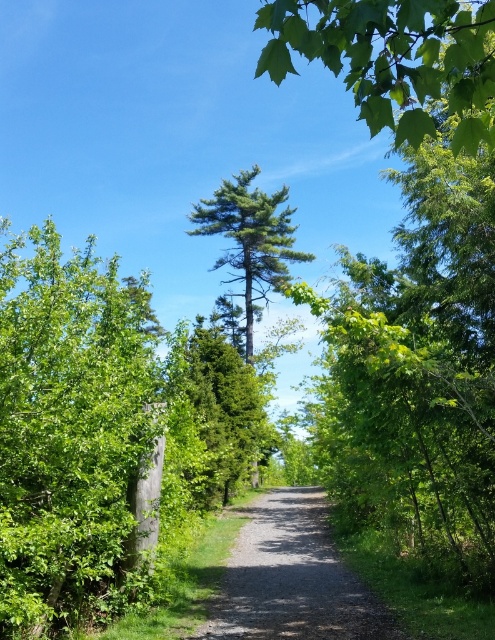
Which is below, green leafy tree at left or dirt/gravel path at center?

Positioned lower is dirt/gravel path at center.

Who is positioned more to the left, green leafy tree at left or dirt/gravel path at center?

From the viewer's perspective, green leafy tree at left appears more on the left side.

Where is `green leafy tree at left`? green leafy tree at left is located at coordinates (66, 424).

Identify the location of green leafy tree at left. The height and width of the screenshot is (640, 495). (66, 424).

Does green leafy tree at left come in front of green leafy tree at upper center?

No, it is not.

Based on the photo, does green leafy tree at left lie behind green leafy tree at upper center?

Yes, green leafy tree at left is behind green leafy tree at upper center.

Is point (15, 237) positioned after point (383, 8)?

Yes, point (15, 237) is farther from viewer.

What are the coordinates of `green leafy tree at left` in the screenshot? It's located at (66, 424).

Is green leafy tree at left below green needle-like tree at center?

Yes.

Can you confirm if green leafy tree at left is taller than green needle-like tree at center?

No.

Is point (49, 433) positioned behind point (260, 230)?

No.

Where is `green leafy tree at left`? The height and width of the screenshot is (640, 495). green leafy tree at left is located at coordinates (66, 424).